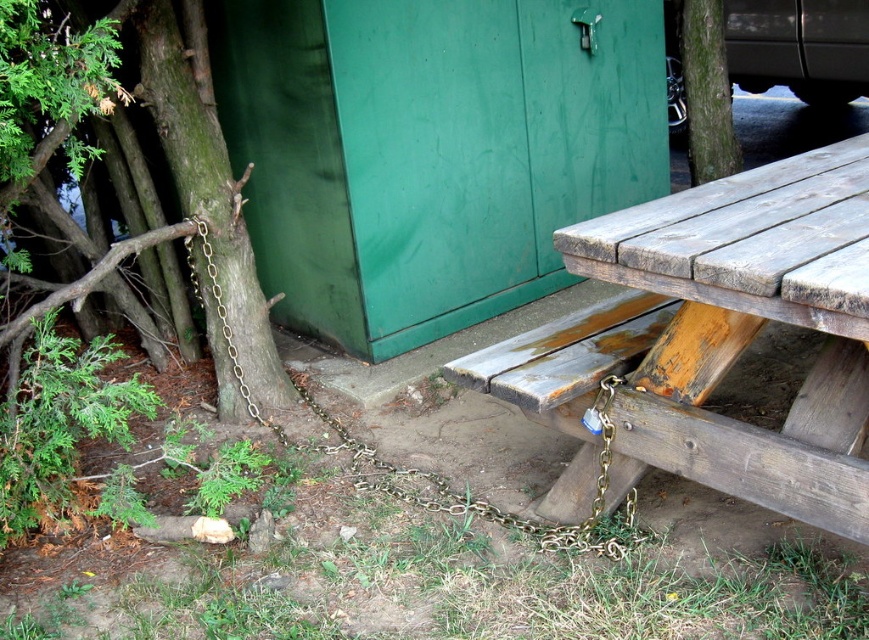
Question: Is green rough bark tree at left closer to the viewer compared to gold chain at lower left?

Choices:
 (A) yes
 (B) no

Answer: (A)

Question: Which object is farther from the camera taking this photo?

Choices:
 (A) green rough bark tree at upper right
 (B) gold chain at lower left

Answer: (A)

Question: Can you confirm if green rough bark tree at upper right is bigger than gold chain at lower left?

Choices:
 (A) no
 (B) yes

Answer: (B)

Question: Which is farther from the green rough bark tree at left?

Choices:
 (A) green rough bark tree at upper right
 (B) gold chain at lower left
 (C) rusty wood picnic table at lower right

Answer: (A)

Question: Which object is farther from the camera taking this photo?

Choices:
 (A) gold chain at lower left
 (B) rusty wood picnic table at lower right
 (C) green rough bark tree at upper right

Answer: (C)

Question: Can you confirm if rusty wood picnic table at lower right is thinner than green rough bark tree at left?

Choices:
 (A) yes
 (B) no

Answer: (B)